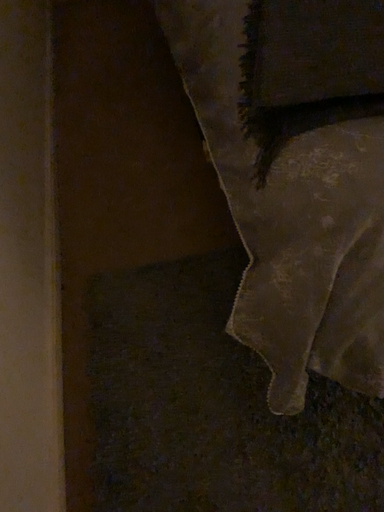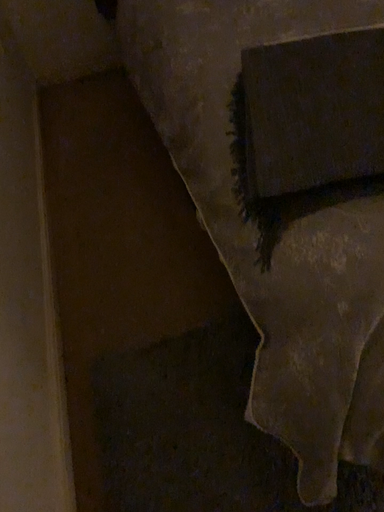
Question: Which way did the camera rotate in the video?

Choices:
 (A) rotated downward
 (B) rotated upward

Answer: (B)